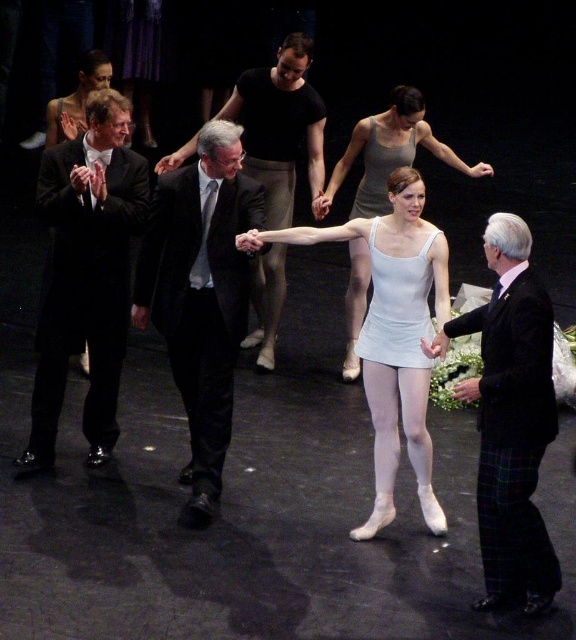
Based on the photo, you are a photographer on stage and want to capture both the white satin leotard at center and the white matte tank top at center in a single photo. Which one should you position your camera to the right of to include both?

To include both the white satin leotard at center and the white matte tank top at center in a single photo, you should position your camera to the right of the white satin leotard at center since it is located to the left of the white matte tank top at center.

You are standing on the stage and want to find the dark gray suit at center. According to the coordinates given, where should you look to locate it?

The dark gray suit at center is located at coordinates point (279, 125).